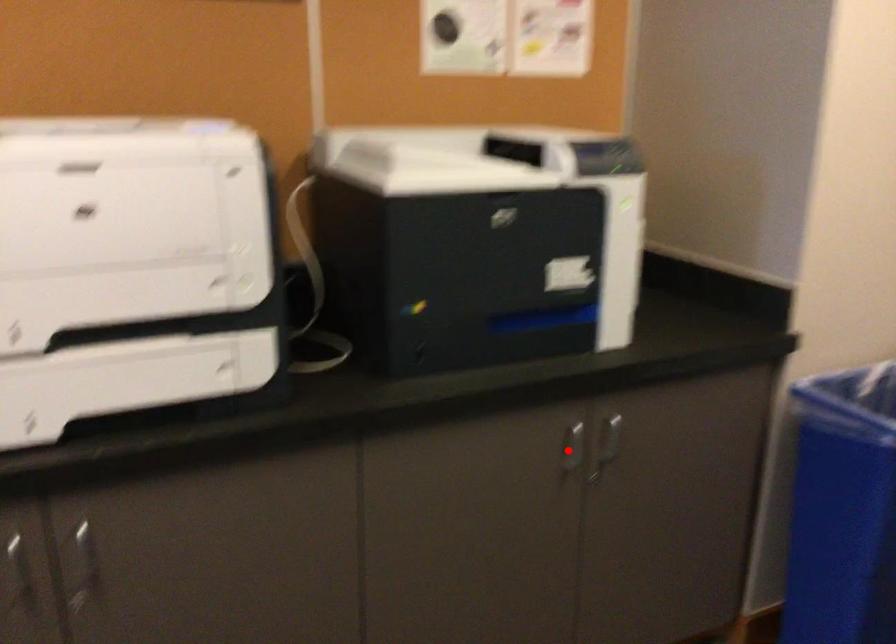
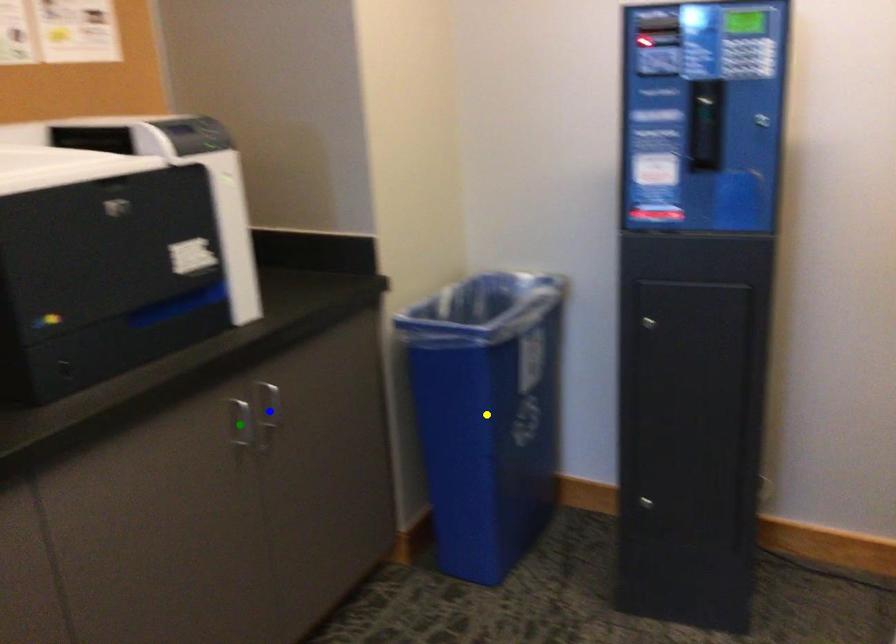
Question: I am providing you with two images of the same scene from different viewpoints. A red point is marked on the first image. You are given multiple points on the second image. Which point in image 2 is actually the same real-world point as the red point in image 1?

Choices:
 (A) green point
 (B) yellow point
 (C) blue point

Answer: (A)